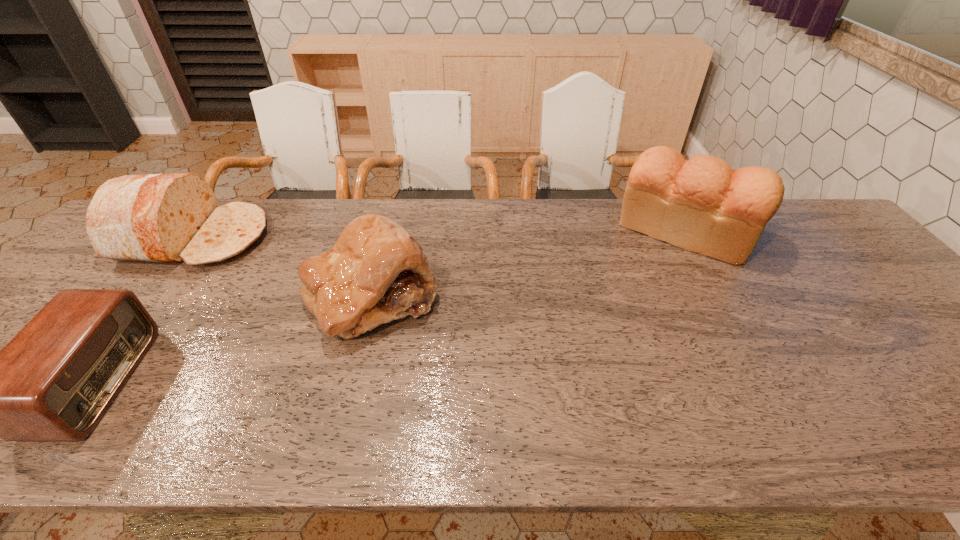
At what (x,y) coordinates should I click in order to perform the action: click on object located in the left edge section of the desktop. Please return your answer as a coordinate pair (x, y). The height and width of the screenshot is (540, 960). Looking at the image, I should click on (167, 218).

Where is `object that is at the far left corner`? Image resolution: width=960 pixels, height=540 pixels. object that is at the far left corner is located at coordinates (167, 218).

Image resolution: width=960 pixels, height=540 pixels. In order to click on vacant space at the far edge of the desktop in this screenshot , I will do `click(280, 226)`.

This screenshot has height=540, width=960. I want to click on free region at the near edge of the desktop, so click(x=36, y=446).

Identify the location of vacant space at the right edge of the desktop. The height and width of the screenshot is (540, 960). (843, 246).

Identify the location of vacant area between the tallest bread and the leftmost bread. click(441, 234).

You are a GUI agent. You are given a task and a screenshot of the screen. Output one action in this format:
    pyautogui.click(x=<x>, y=<y>)
    Task: Click on the vacant area between the tallest bread and the leftmost bread
    The image size is (960, 540).
    Given the screenshot: What is the action you would take?
    pyautogui.click(x=441, y=234)

This screenshot has width=960, height=540. Find the location of `vacant space that is in between the third object from left to right and the rightmost object`. vacant space that is in between the third object from left to right and the rightmost object is located at coordinates (528, 263).

The width and height of the screenshot is (960, 540). Find the location of `unoccupied position between the third object from left to right and the tallest object`. unoccupied position between the third object from left to right and the tallest object is located at coordinates (528, 263).

Identify the location of empty location between the second object from right to left and the shortest object. Image resolution: width=960 pixels, height=540 pixels. (233, 339).